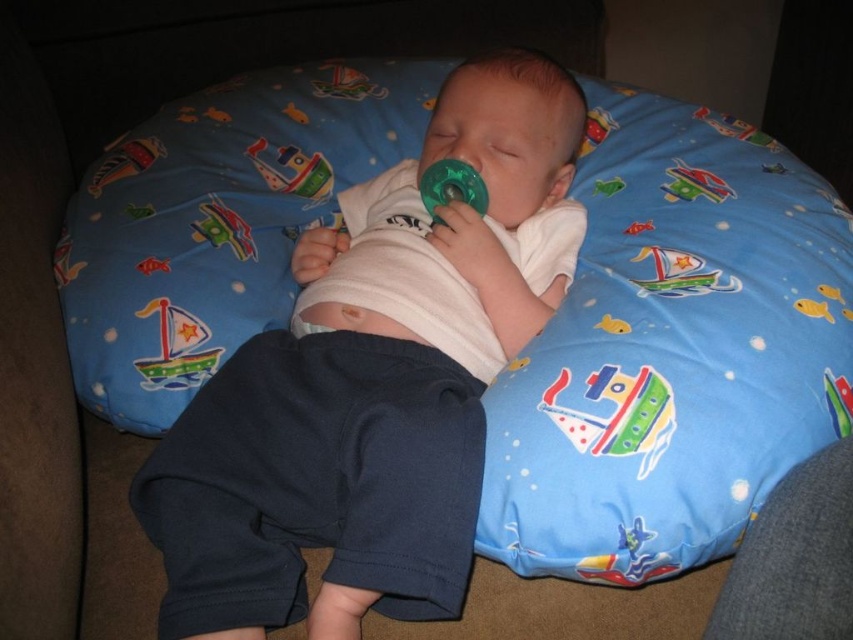
Question: Can you confirm if green plastic pacifier at center is positioned to the right of green plastic airplane at upper left?

Choices:
 (A) no
 (B) yes

Answer: (B)

Question: Which of the following is the closest to the observer?

Choices:
 (A) (456, 438)
 (B) (291, 166)
 (C) (694, 168)

Answer: (A)

Question: Estimate the real-world distances between objects in this image. Which object is closer to the white cotton baby at center?

Choices:
 (A) matte plastic boat at upper center
 (B) matte green pacifier at center

Answer: (B)

Question: Is green plastic pacifier at center positioned behind green plastic pacifier at upper center?

Choices:
 (A) no
 (B) yes

Answer: (B)

Question: Does white cotton baby at center appear on the left side of green plastic pacifier at upper center?

Choices:
 (A) no
 (B) yes

Answer: (B)

Question: Which object is closer to the camera taking this photo?

Choices:
 (A) matte plastic boat at upper center
 (B) green plastic pacifier at center
 (C) green plastic pacifier at upper center

Answer: (C)